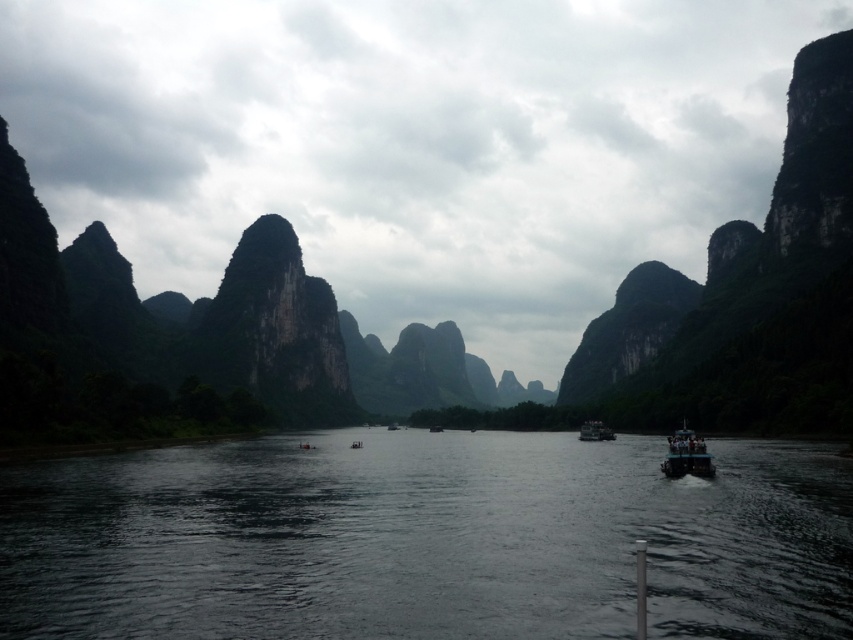
You are standing at the riverbank in the image and want to cross to the opposite side. The point you need to reach is marked by point (427,540). Is there any object between you and that point that might block your path?

The point (427,540) corresponds to dark water at center, which is part of the river. Since the river is calm and the point is in the water, there are no objects blocking your path to that point.